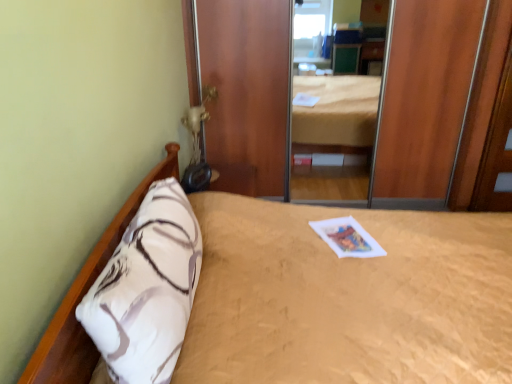
Question: Relative to wooden door at right, is beige textured bed at center in front or behind?

Choices:
 (A) behind
 (B) front

Answer: (B)

Question: Looking at their shapes, would you say beige textured bed at center is wider or thinner than wooden door at right?

Choices:
 (A) wide
 (B) thin

Answer: (A)

Question: Estimate the real-world distances between objects in this image. Which object is closer to the wooden door at right?

Choices:
 (A) white paper magazine at center
 (B) white soft pillow at left
 (C) beige textured bed at center

Answer: (A)

Question: Based on their relative distances, which object is farther from the white soft pillow at left?

Choices:
 (A) beige textured bed at center
 (B) wooden door at right
 (C) white paper magazine at center

Answer: (B)